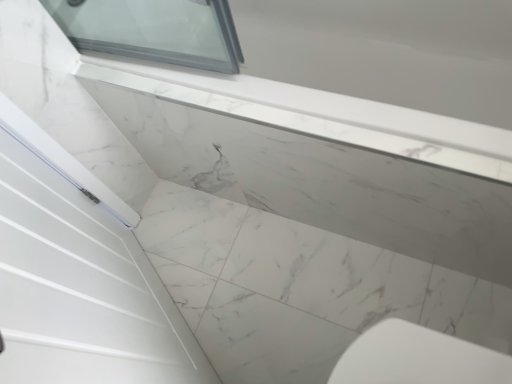
Locate an element on the screen. The image size is (512, 384). empty space that is ontop of white marble window sill at upper center (from a real-world perspective) is located at coordinates (310, 128).